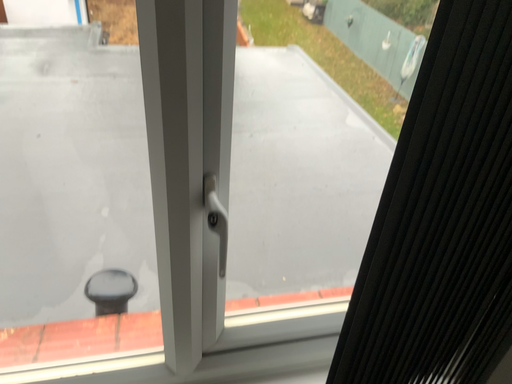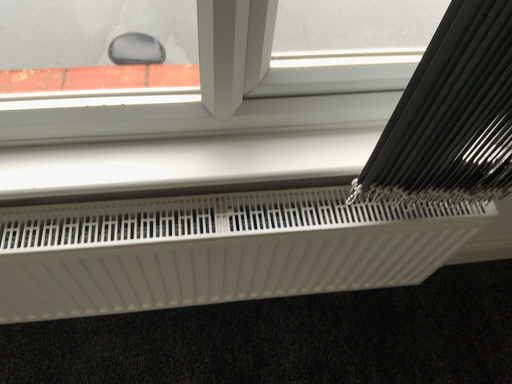
Question: How did the camera likely rotate when shooting the video?

Choices:
 (A) rotated upward
 (B) rotated downward

Answer: (B)